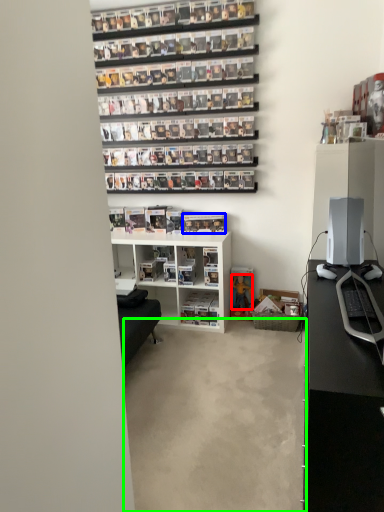
Question: Which object is the farthest from toy (highlighted by a red box)? Choose among these: book (highlighted by a blue box) or concrete (highlighted by a green box).

Choices:
 (A) book
 (B) concrete

Answer: (B)